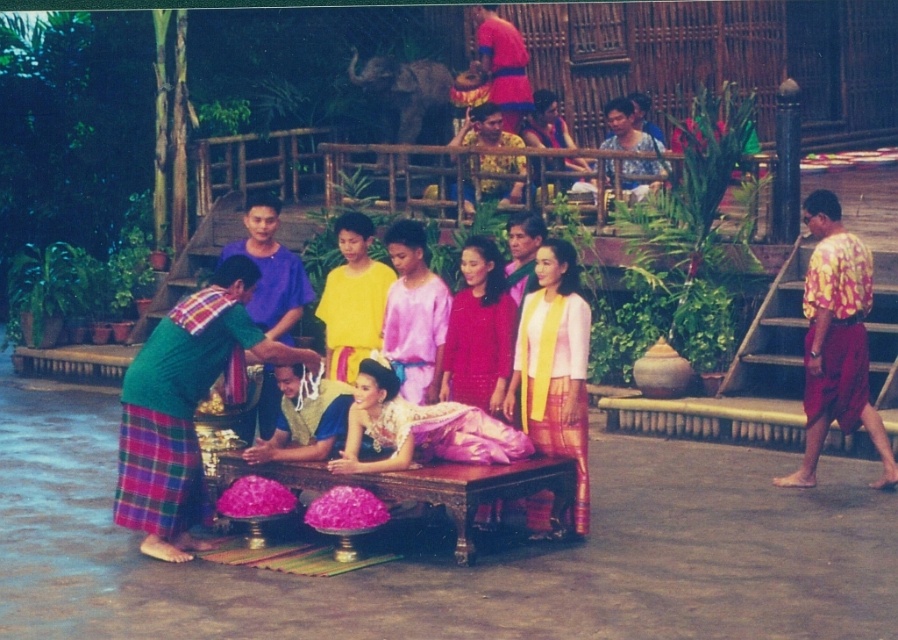
Question: Which point is closer to the camera?

Choices:
 (A) (395, 250)
 (B) (568, 408)
 (C) (336, 365)
 (D) (486, 376)

Answer: (B)

Question: Is silk yellow scarf at center to the right of yellow satin shirt at center from the viewer's perspective?

Choices:
 (A) yes
 (B) no

Answer: (A)

Question: Is matte blue dress at upper center thinner than matte pink fabric at upper center?

Choices:
 (A) no
 (B) yes

Answer: (B)

Question: Which object appears farthest from the camera in this image?

Choices:
 (A) matte blue dress at upper center
 (B) pink satin dress at center
 (C) matte pink fabric at upper center

Answer: (C)

Question: Does matte pink dress at center appear under matte pink fabric at upper center?

Choices:
 (A) yes
 (B) no

Answer: (A)

Question: Among these points, which one is nearest to the camera?

Choices:
 (A) (399, 243)
 (B) (613, 118)
 (C) (580, 161)

Answer: (A)